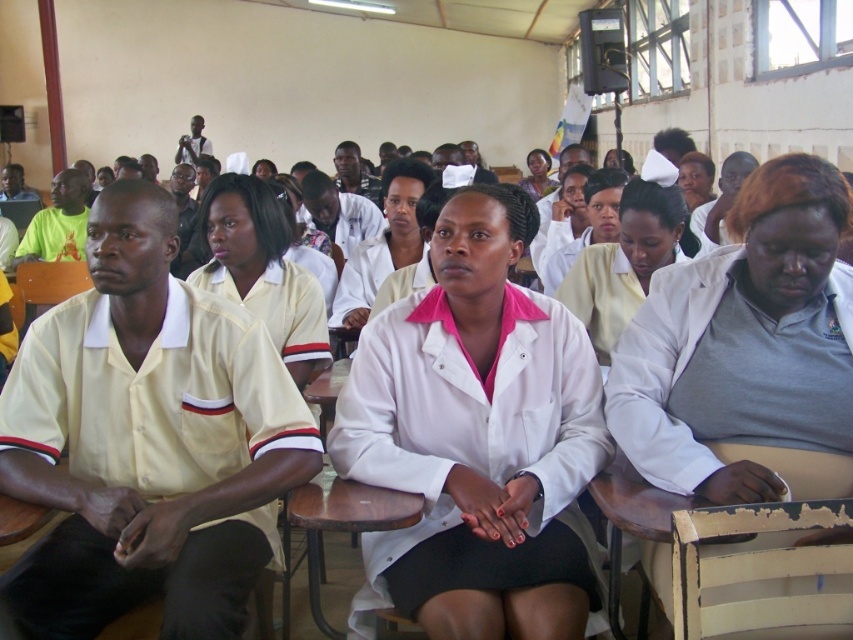
Between white lab coat at center and white smooth shirt at center, which one has more height?

With more height is white lab coat at center.

Between point (804, 264) and point (247, 225), which one is positioned behind?

The point (247, 225) is behind.

This screenshot has width=853, height=640. I want to click on white lab coat at center, so click(744, 344).

Can you confirm if wooden chair at left is positioned below matte white coat at center?

Yes.

Who is more forward, (41, 296) or (544, 164)?

Point (41, 296)

Describe the element at coordinates (49, 284) in the screenshot. The image size is (853, 640). I see `wooden chair at left` at that location.

Locate an element on the screen. The width and height of the screenshot is (853, 640). wooden chair at left is located at coordinates (49, 284).

Is white smooth lab coat at center behind white smooth nurse cap at center?

No.

Which is in front, point (430, 433) or point (569, 280)?

Point (430, 433) is in front.

Does point (428, 332) come closer to viewer compared to point (671, 198)?

That is True.

Where is `white smooth lab coat at center`? The image size is (853, 640). white smooth lab coat at center is located at coordinates (477, 440).